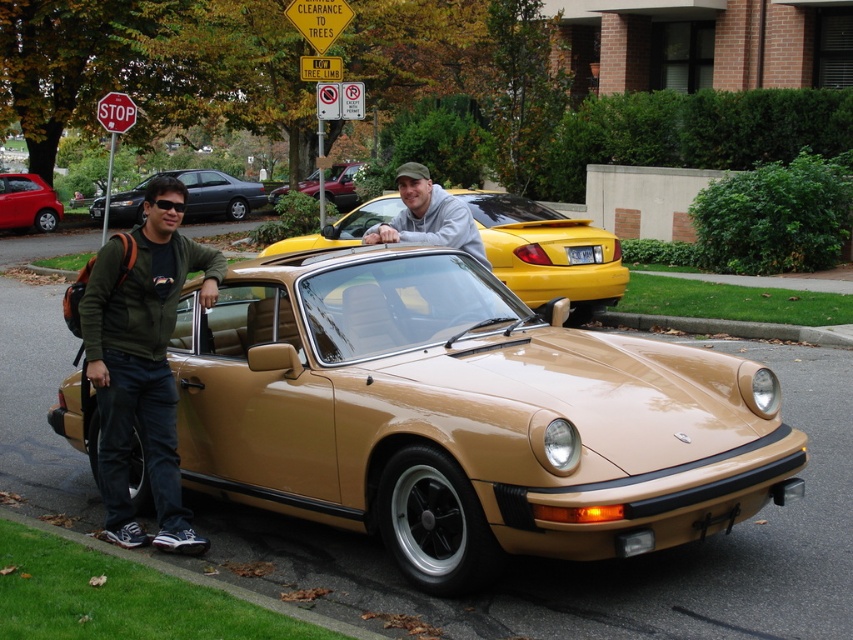
Is green fabric jacket at left positioned before matte black hatchback at left?

Yes, green fabric jacket at left is in front of matte black hatchback at left.

You are a GUI agent. You are given a task and a screenshot of the screen. Output one action in this format:
    pyautogui.click(x=<x>, y=<y>)
    Task: Click on the green fabric jacket at left
    This screenshot has height=640, width=853.
    Given the screenshot: What is the action you would take?
    pyautogui.click(x=142, y=362)

The height and width of the screenshot is (640, 853). Describe the element at coordinates (142, 362) in the screenshot. I see `green fabric jacket at left` at that location.

Where is `green fabric jacket at left`? Image resolution: width=853 pixels, height=640 pixels. green fabric jacket at left is located at coordinates (142, 362).

Does metallic red car at center have a larger size compared to red plastic stop sign at upper left?

Yes.

Can you confirm if metallic red car at center is positioned above red plastic stop sign at upper left?

Yes, metallic red car at center is above red plastic stop sign at upper left.

What are the coordinates of `metallic red car at center` in the screenshot? It's located at (341, 184).

Is tan metallic car at center smaller than red plastic stop sign at upper left?

Incorrect, tan metallic car at center is not smaller in size than red plastic stop sign at upper left.

Looking at this image, which of these two, tan metallic car at center or red plastic stop sign at upper left, stands shorter?

red plastic stop sign at upper left

Does point (218, 368) come farther from viewer compared to point (105, 104)?

No.

You are a GUI agent. You are given a task and a screenshot of the screen. Output one action in this format:
    pyautogui.click(x=<x>, y=<y>)
    Task: Click on the tan metallic car at center
    
    Given the screenshot: What is the action you would take?
    pyautogui.click(x=463, y=417)